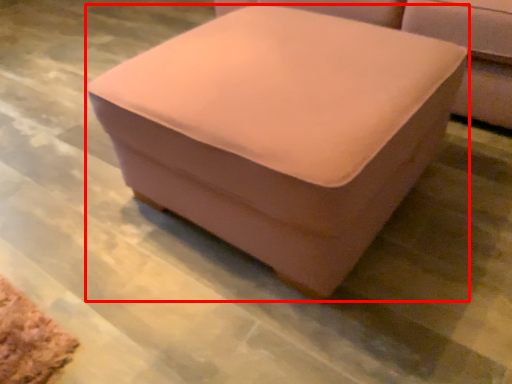
Question: From the image, what is the correct spatial relationship of furniture (annotated by the red box) in relation to studio couch?

Choices:
 (A) left
 (B) right

Answer: (A)